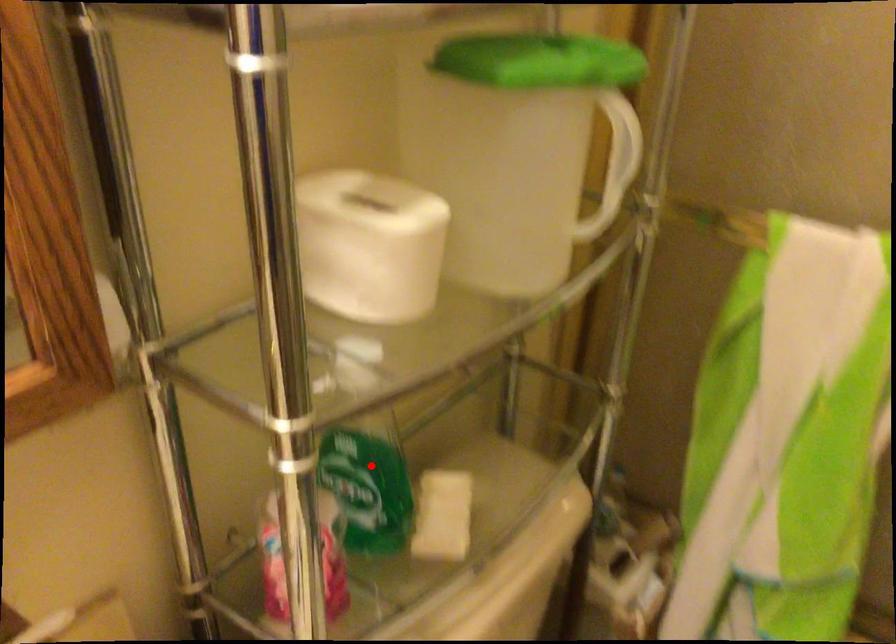
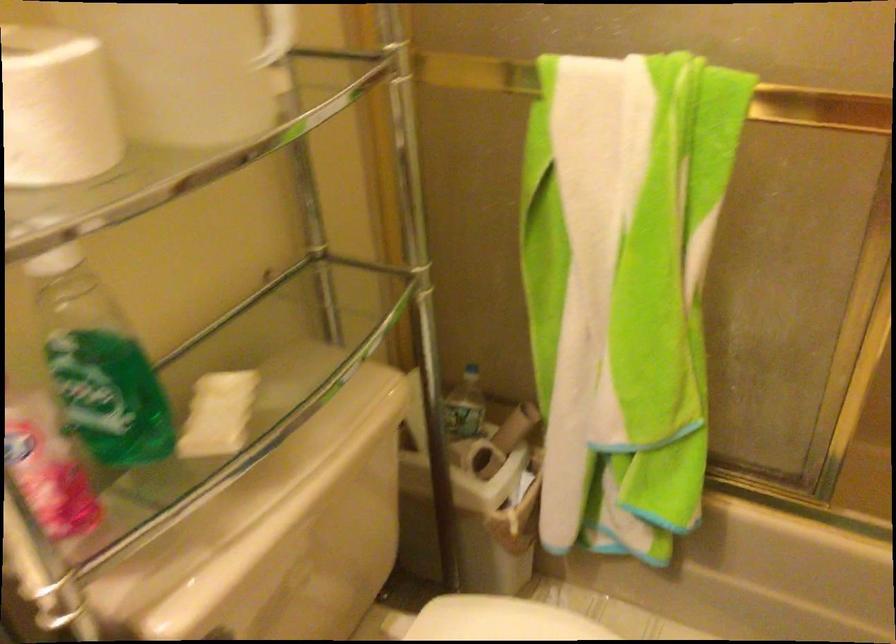
Find the pixel in the second image that matches the highlighted location in the first image.

(98, 365)